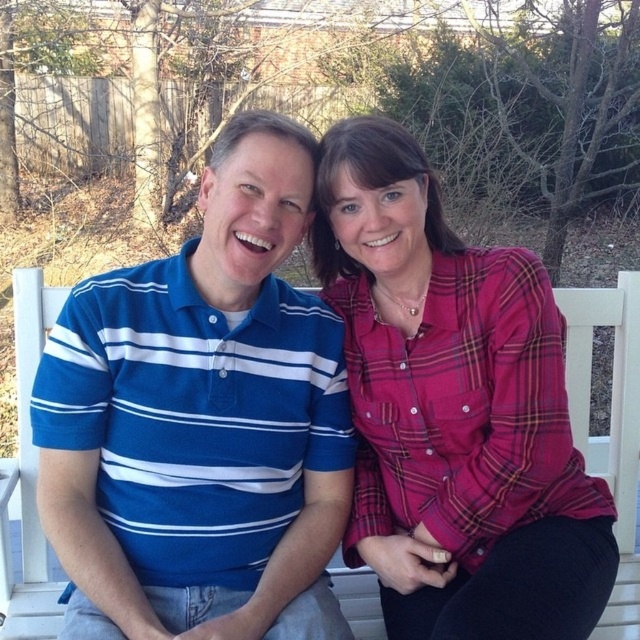
You are standing in front of the bench where the two people are sitting. You want to place a small gift box exactly at the point marked as point (173,508). If the gift box has a diameter of 0.5 meters, will it fit entirely within your field of view without any part being obscured by the two people?

The point (173,508) is 1.44 meters from the viewer. Since the gift box has a diameter of 0.5 meters, it can fit within the field of view as long as there are no obstructions. However, the two people sitting on the bench might block part of the view depending on their exact positions. Without additional information about their proximity to the point, it is uncertain if the gift box will be fully visible.

You are a photographer setting up a shoot in this outdoor scene. You need to ensure that the blue striped polo shirt at left and the plaid fabric shirt at center are both visible in the frame. Considering their sizes, which shirt should you focus on to make sure it doesn

The blue striped polo shirt at left is smaller in size compared to the plaid fabric shirt at center. To ensure both are visible, focus on framing the larger plaid fabric shirt at center first, then adjust to include the smaller blue striped polo shirt at left.

Based on the photo, you are a photographer setting up a shot of two people on a bench. You need to ensure that the blue striped polo shirt at left and the plaid fabric shirt at center are both in frame. Based on their positions, which shirt should you focus on first to capture both in the shot?

The blue striped polo shirt at left is to the left of the plaid fabric shirt at center, so focusing on the plaid fabric shirt at center first would allow you to frame both shirts since the blue striped polo shirt at left is positioned to its left.